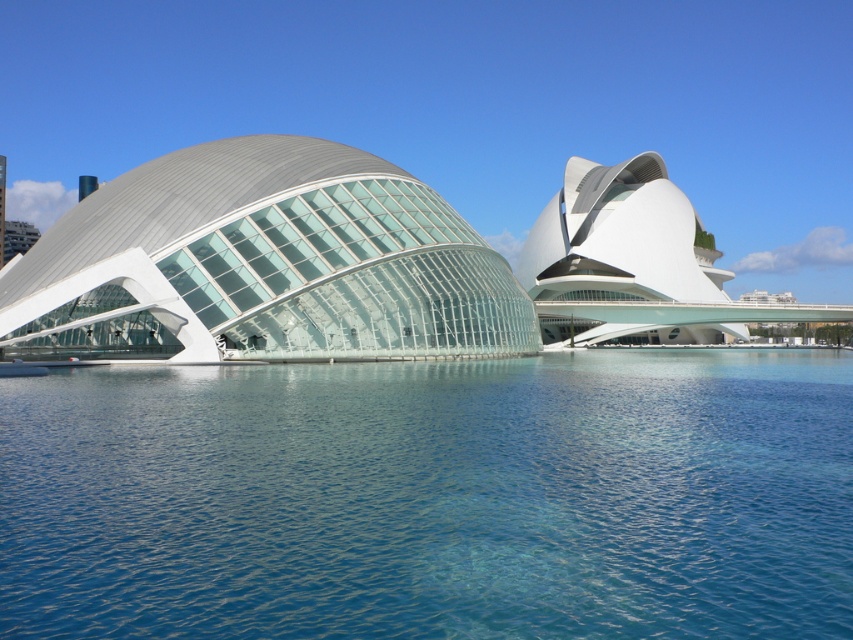
Question: Which point is closer to the camera?

Choices:
 (A) (782, 608)
 (B) (163, 264)

Answer: (A)

Question: Which point is farther to the camera?

Choices:
 (A) transparent glass dome at left
 (B) transparent blue water at center

Answer: (A)

Question: Can you confirm if transparent blue water at center is positioned below transparent glass dome at left?

Choices:
 (A) yes
 (B) no

Answer: (A)

Question: Considering the relative positions of transparent blue water at center and transparent glass dome at left in the image provided, where is transparent blue water at center located with respect to transparent glass dome at left?

Choices:
 (A) below
 (B) above

Answer: (A)

Question: Is transparent blue water at center further to camera compared to transparent glass dome at left?

Choices:
 (A) no
 (B) yes

Answer: (A)